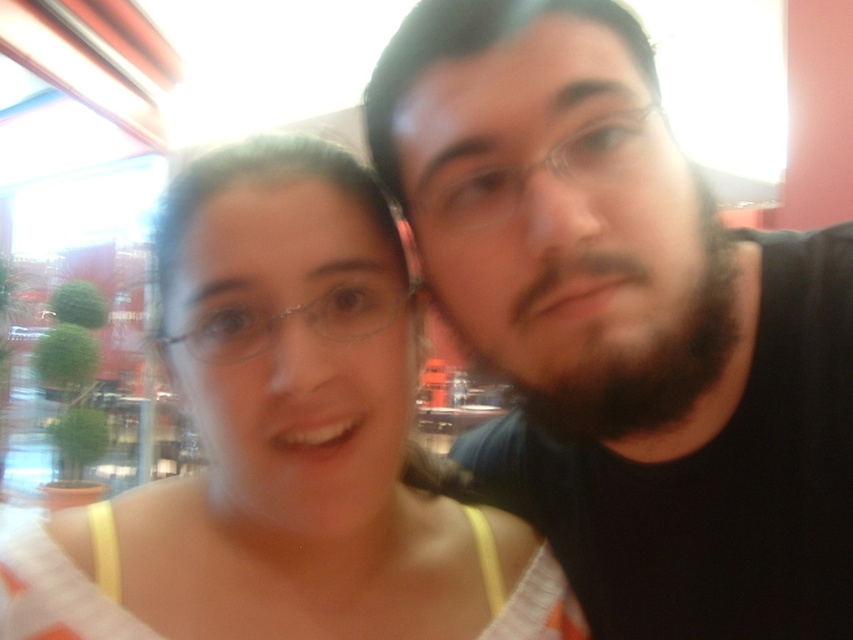
Question: Which of the following is the closest to the observer?

Choices:
 (A) black matte shirt at right
 (B) matte white tank top at center

Answer: (A)

Question: Which point is closer to the camera taking this photo?

Choices:
 (A) (358, 416)
 (B) (753, 582)

Answer: (A)

Question: Can you confirm if black matte shirt at right is smaller than matte white tank top at center?

Choices:
 (A) no
 (B) yes

Answer: (A)

Question: Is black matte shirt at right further to the viewer compared to matte white tank top at center?

Choices:
 (A) yes
 (B) no

Answer: (B)

Question: Which point is closer to the camera taking this photo?

Choices:
 (A) (740, 440)
 (B) (183, 534)

Answer: (B)

Question: Does black matte shirt at right have a smaller size compared to matte white tank top at center?

Choices:
 (A) no
 (B) yes

Answer: (A)